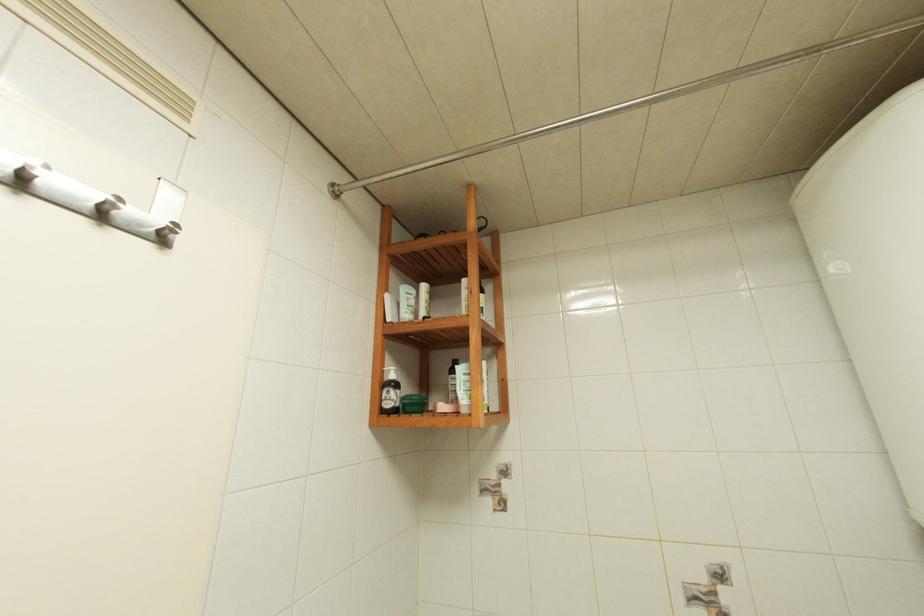
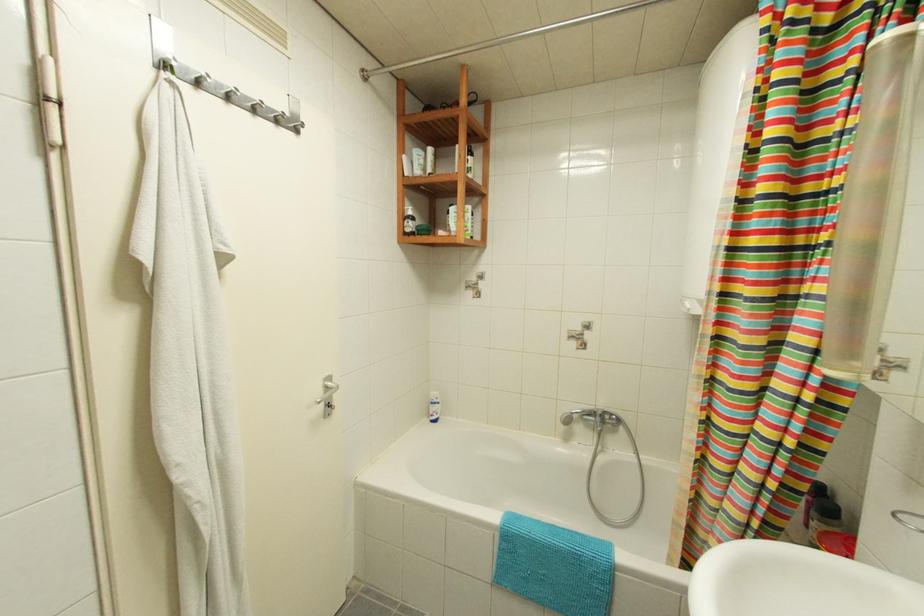
Question: The images are taken continuously from a first-person perspective. In which direction are you moving?

Choices:
 (A) Left
 (B) Right
 (C) Forward
 (D) Backward

Answer: (D)